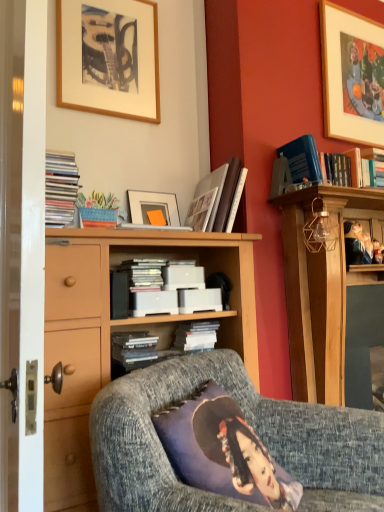
Question: Considering the relative sizes of white matte book at center, which is the 4th book in top-to-bottom order, and smooth wooden frame at upper right, positioned as the first person in left-to-right order, in the image provided, is white matte book at center, which is the 4th book in top-to-bottom order, shorter than smooth wooden frame at upper right, positioned as the first person in left-to-right order,?

Choices:
 (A) yes
 (B) no

Answer: (A)

Question: Does white matte book at center, which is counted as the 2th book, starting from the left, touch smooth wooden frame at upper right, which is counted as the second person, starting from the right?

Choices:
 (A) yes
 (B) no

Answer: (B)

Question: From a real-world perspective, is white matte book at center, which is counted as the 2th book, starting from the left, physically below smooth wooden frame at upper right, positioned as the first person in left-to-right order?

Choices:
 (A) yes
 (B) no

Answer: (A)

Question: Can you confirm if white matte book at center, the third book viewed from the right, is thinner than smooth wooden frame at upper right, which is counted as the second person, starting from the right?

Choices:
 (A) yes
 (B) no

Answer: (B)

Question: Is white matte book at center, the third book viewed from the right, in front of smooth wooden frame at upper right, positioned as the first person in left-to-right order?

Choices:
 (A) no
 (B) yes

Answer: (B)

Question: Does point (203, 330) appear closer or farther from the camera than point (357, 245)?

Choices:
 (A) closer
 (B) farther

Answer: (A)

Question: In the image, is white matte book at center, which is counted as the 3th book, starting from the top, positioned in front of or behind smooth wooden frame at upper right, positioned as the first person in left-to-right order?

Choices:
 (A) front
 (B) behind

Answer: (A)

Question: Is white matte book at center, which appears as the third book when viewed from the left, situated inside smooth wooden frame at upper right, which is counted as the second person, starting from the right, or outside?

Choices:
 (A) inside
 (B) outside

Answer: (B)

Question: From a real-world perspective, is white matte book at center, the second book from the right, above or below smooth wooden frame at upper right, positioned as the first person in left-to-right order?

Choices:
 (A) above
 (B) below

Answer: (B)

Question: Is point (334, 101) closer or farther from the camera than point (241, 269)?

Choices:
 (A) closer
 (B) farther

Answer: (B)

Question: From a real-world perspective, is wooden picture frame at upper right, the 1th picture frame positioned from the back, above or below wooden cabinet at center?

Choices:
 (A) above
 (B) below

Answer: (A)

Question: In terms of height, does wooden picture frame at upper right, which is the 2th picture frame from left to right, look taller or shorter compared to wooden cabinet at center?

Choices:
 (A) short
 (B) tall

Answer: (A)

Question: Considering their positions, is wooden picture frame at upper right, arranged as the first picture frame when viewed from the right, located in front of or behind wooden cabinet at center?

Choices:
 (A) behind
 (B) front

Answer: (A)

Question: In terms of size, does smooth wooden frame at upper right, which is counted as the 1th person, starting from the right, appear bigger or smaller than smooth wooden frame at upper right, positioned as the first person in left-to-right order?

Choices:
 (A) small
 (B) big

Answer: (A)

Question: From the image's perspective, is smooth wooden frame at upper right, the 2th person when ordered from left to right, located above or below smooth wooden frame at upper right, which is counted as the second person, starting from the right?

Choices:
 (A) below
 (B) above

Answer: (A)